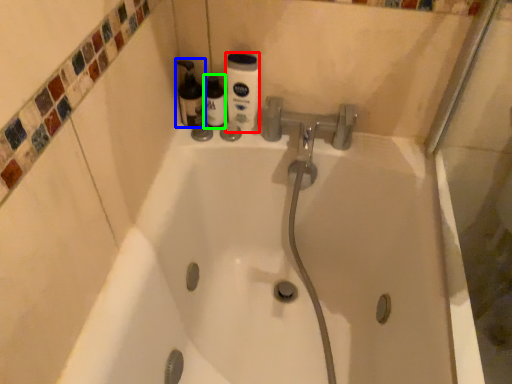
Question: Which object is the closest to the cleaning product (highlighted by a red box)? Choose among these: cleaning product (highlighted by a blue box) or bottle (highlighted by a green box).

Choices:
 (A) cleaning product
 (B) bottle

Answer: (B)